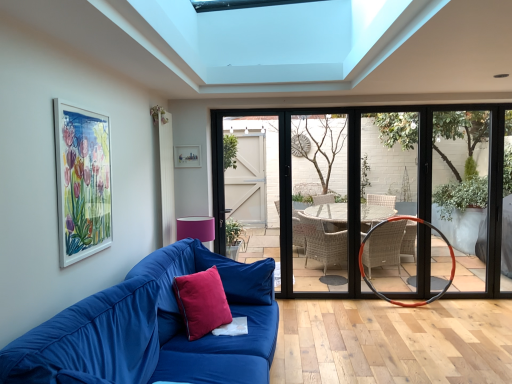
Question: From a real-world perspective, is matte black door at center physically below white glossy picture frame at upper left, which is the 2th picture frame in right-to-left order?

Choices:
 (A) yes
 (B) no

Answer: (A)

Question: From the image's perspective, does matte black door at center appear lower than white glossy picture frame at upper left, which is the 2th picture frame in right-to-left order?

Choices:
 (A) no
 (B) yes

Answer: (B)

Question: Considering the relative sizes of matte black door at center and white glossy picture frame at upper left, which is the 2th picture frame in right-to-left order, in the image provided, is matte black door at center wider than white glossy picture frame at upper left, which is the 2th picture frame in right-to-left order,?

Choices:
 (A) yes
 (B) no

Answer: (A)

Question: Is matte black door at center further to camera compared to white glossy picture frame at upper left, the first picture frame positioned from the front?

Choices:
 (A) yes
 (B) no

Answer: (A)

Question: Is matte black door at center shorter than white glossy picture frame at upper left, placed as the 2th picture frame when sorted from back to front?

Choices:
 (A) no
 (B) yes

Answer: (A)

Question: Can you confirm if matte black door at center is positioned to the left of white glossy picture frame at upper left, which is the 2th picture frame in right-to-left order?

Choices:
 (A) no
 (B) yes

Answer: (A)

Question: Does satin red pillow at center, acting as the first pillow starting from the front, have a greater height compared to matte black door at center?

Choices:
 (A) no
 (B) yes

Answer: (A)

Question: Is satin red pillow at center, acting as the second pillow starting from the back, thinner than matte black door at center?

Choices:
 (A) no
 (B) yes

Answer: (A)

Question: Does satin red pillow at center, acting as the second pillow starting from the back, have a lesser height compared to matte black door at center?

Choices:
 (A) no
 (B) yes

Answer: (B)

Question: From a real-world perspective, is satin red pillow at center, acting as the second pillow starting from the back, on top of matte black door at center?

Choices:
 (A) no
 (B) yes

Answer: (A)

Question: Is satin red pillow at center, acting as the second pillow starting from the back, at the left side of matte black door at center?

Choices:
 (A) yes
 (B) no

Answer: (A)

Question: From the image's perspective, would you say satin red pillow at center, acting as the first pillow starting from the front, is shown under matte black door at center?

Choices:
 (A) no
 (B) yes

Answer: (B)

Question: Can you confirm if velvet blue couch at lower left is bigger than velvet red pillow at lower left, positioned as the 1th pillow in back-to-front order?

Choices:
 (A) no
 (B) yes

Answer: (B)